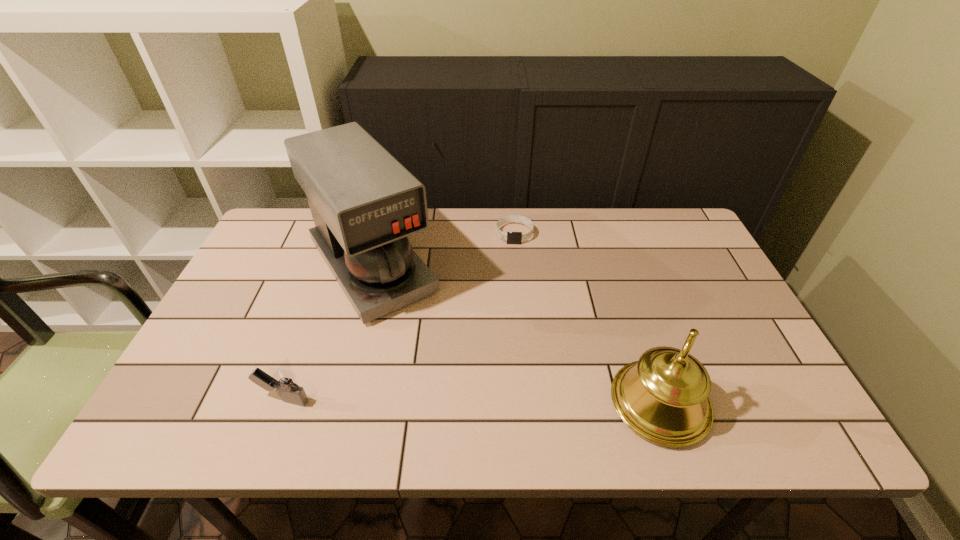
I want to click on vacant space on the desktop that is between the igniter and the rightmost object and is positioned on the carafe side of the coffee maker, so click(469, 402).

You are a GUI agent. You are given a task and a screenshot of the screen. Output one action in this format:
    pyautogui.click(x=<x>, y=<y>)
    Task: Click on the free space on the desktop that is between the igniter and the bell and is positioned on the outer surface of the wristband
    The width and height of the screenshot is (960, 540).
    Given the screenshot: What is the action you would take?
    pyautogui.click(x=516, y=402)